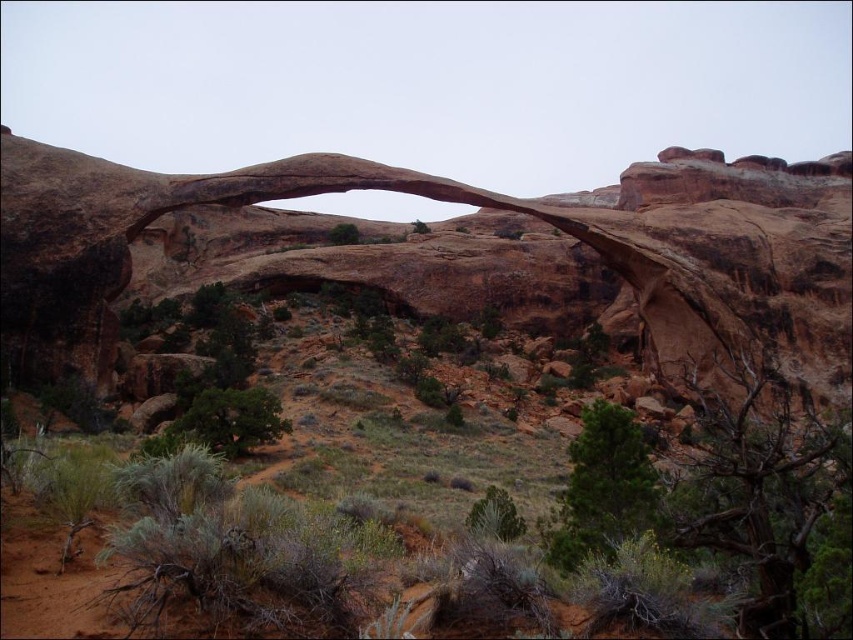
Question: Which point is closer to the camera?

Choices:
 (A) green leafy bush at lower left
 (B) rustic sandstone arch at center
 (C) green needle-like at center

Answer: (C)

Question: Can you confirm if green leafy bush at lower left is positioned above green leafy shrub at center?

Choices:
 (A) no
 (B) yes

Answer: (A)

Question: Based on their relative distances, which object is nearer to the green leafy bush at lower left?

Choices:
 (A) green shrubs at center
 (B) green leafy bush at center

Answer: (B)

Question: Is green leafy bush at center bigger than green leafy shrub at center?

Choices:
 (A) yes
 (B) no

Answer: (B)

Question: Which is farther from the rustic sandstone arch at center?

Choices:
 (A) green shrubs at center
 (B) green leafy bush at center
 (C) green leafy bush at lower left
 (D) green needle-like at center

Answer: (B)

Question: Is green needle-like at center bigger than green leafy shrub at center?

Choices:
 (A) no
 (B) yes

Answer: (B)